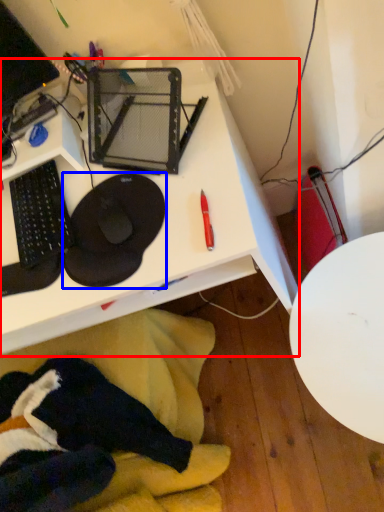
Question: Which of the following is the farthest to the observer, desk (highlighted by a red box) or sit (highlighted by a blue box)?

Choices:
 (A) desk
 (B) sit

Answer: (B)